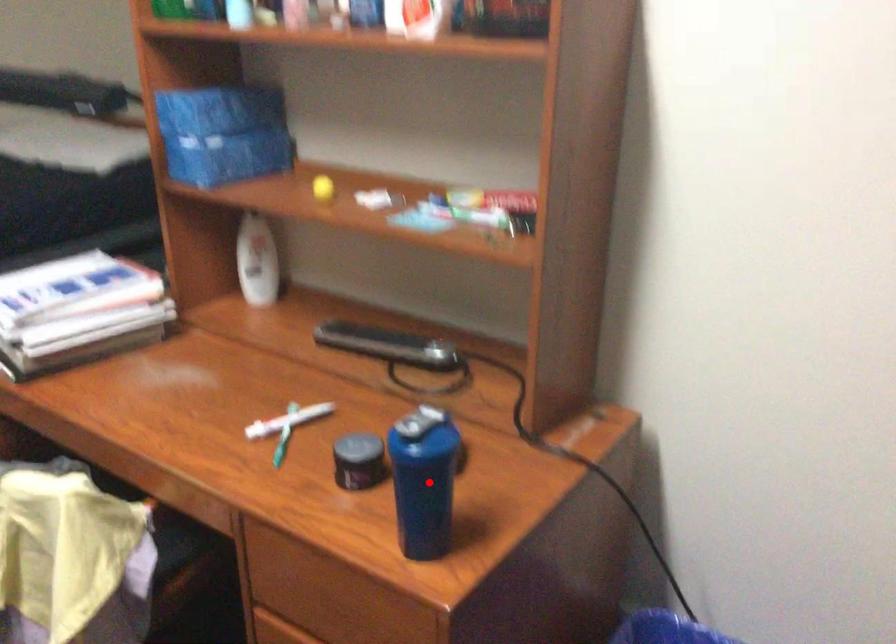
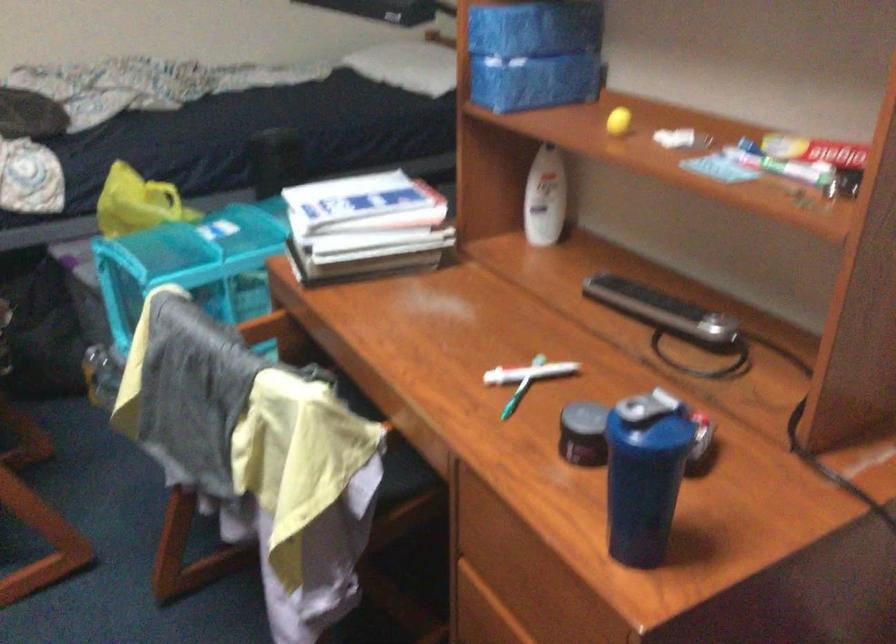
Where in the second image is the point corresponding to the highlighted location from the first image?

(644, 474)